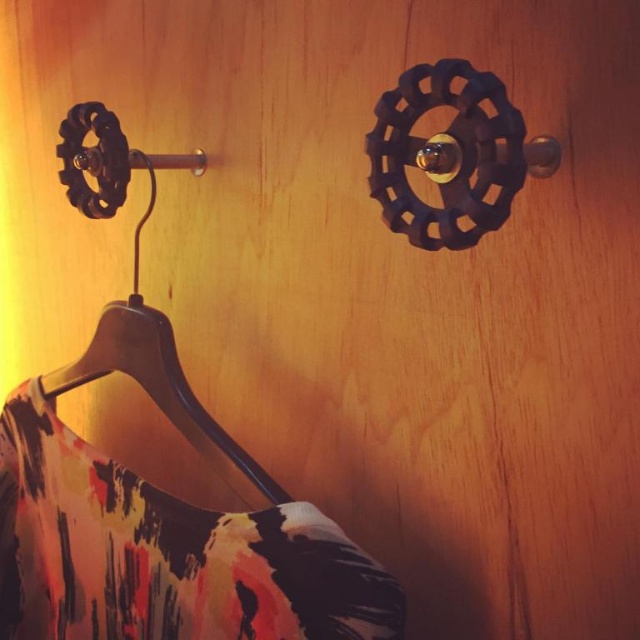
Question: Is printed fabric dress at lower left to the right of wooden hanger at lower left from the viewer's perspective?

Choices:
 (A) no
 (B) yes

Answer: (A)

Question: Considering the relative positions of printed fabric dress at lower left and wooden hanger at lower left in the image provided, where is printed fabric dress at lower left located with respect to wooden hanger at lower left?

Choices:
 (A) right
 (B) left

Answer: (B)

Question: Which of the following is the closest to the observer?

Choices:
 (A) wooden hanger at lower left
 (B) printed fabric dress at lower left

Answer: (B)

Question: Among these objects, which one is nearest to the camera?

Choices:
 (A) printed fabric dress at lower left
 (B) wooden hanger at lower left

Answer: (A)

Question: Is printed fabric dress at lower left smaller than wooden hanger at lower left?

Choices:
 (A) yes
 (B) no

Answer: (B)

Question: Which point appears closest to the camera in this image?

Choices:
 (A) (92, 353)
 (B) (65, 564)

Answer: (A)